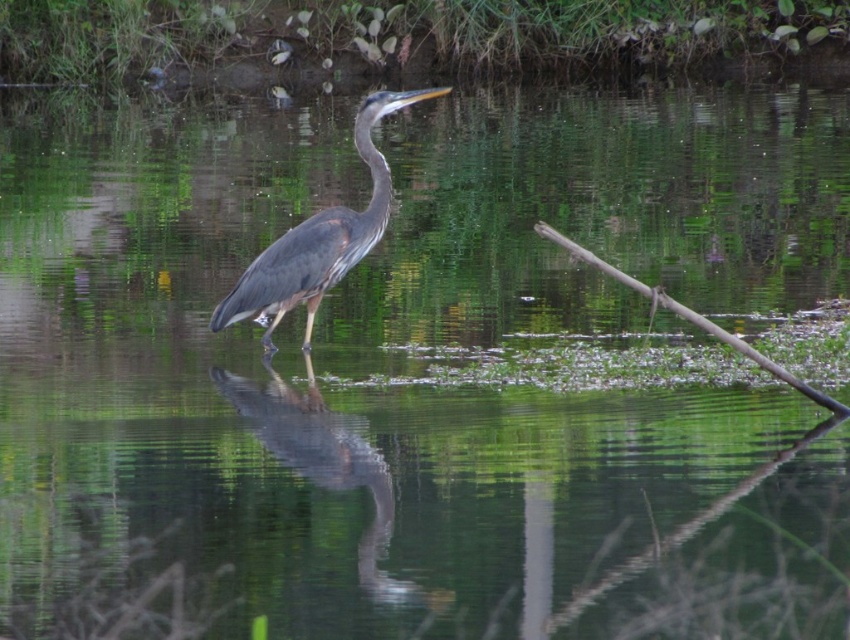
You are an ornithologist observing two herons in the water. You see the shiny blue heron at center and the gray matte heron at center. Which one has a larger width according to the description?

The shiny blue heron at center might be wider than the gray matte heron at center.

You are a photographer trying to capture the shiny blue heron at center. You need to position your camera at a specific coordinate to frame it perfectly. What are the exact coordinates where the heron is located?

The shiny blue heron at center is located at the 2D coordinates point of (327, 467).